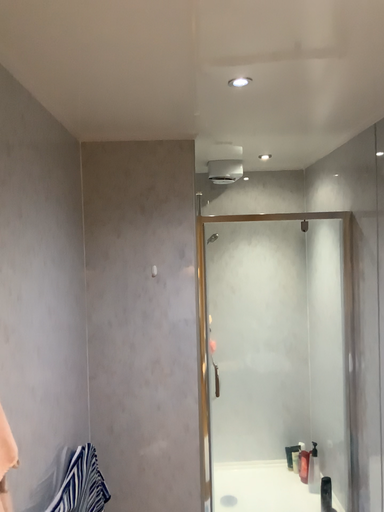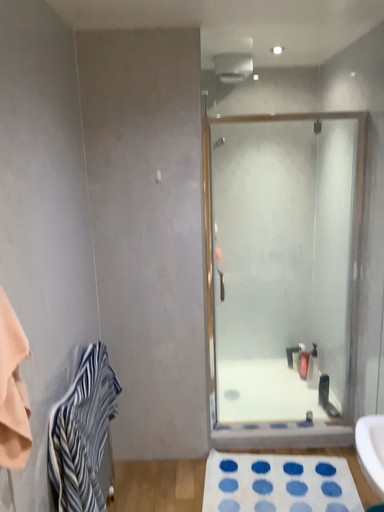
Question: How did the camera likely rotate when shooting the video?

Choices:
 (A) rotated downward
 (B) rotated upward

Answer: (A)